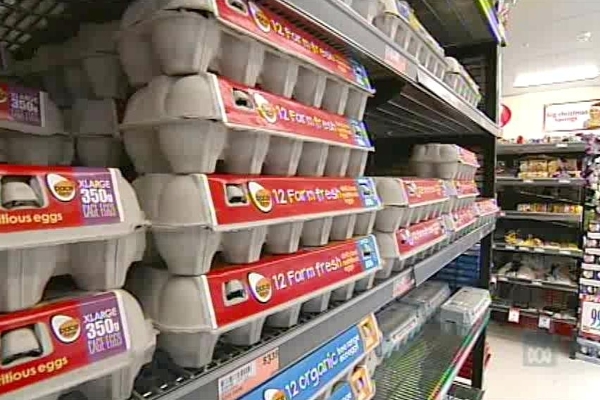
The width and height of the screenshot is (600, 400). What are the coordinates of `shelves` in the screenshot? It's located at (409, 284), (460, 360), (428, 86), (490, 23), (536, 212), (530, 180), (525, 147), (545, 248), (557, 284), (539, 320).